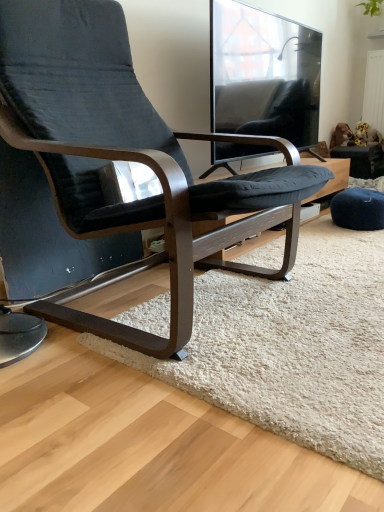
Question: Is white textured radiator at upper right to the right of white shaggy rug at center from the viewer's perspective?

Choices:
 (A) yes
 (B) no

Answer: (A)

Question: Considering the relative sizes of white textured radiator at upper right and white shaggy rug at center in the image provided, is white textured radiator at upper right bigger than white shaggy rug at center?

Choices:
 (A) yes
 (B) no

Answer: (B)

Question: From the image's perspective, is white textured radiator at upper right located above white shaggy rug at center?

Choices:
 (A) yes
 (B) no

Answer: (A)

Question: Is white textured radiator at upper right to the left of white shaggy rug at center from the viewer's perspective?

Choices:
 (A) yes
 (B) no

Answer: (B)

Question: Is white textured radiator at upper right far from white shaggy rug at center?

Choices:
 (A) yes
 (B) no

Answer: (A)

Question: Can you see white textured radiator at upper right touching white shaggy rug at center?

Choices:
 (A) no
 (B) yes

Answer: (A)

Question: From a real-world perspective, is white textured radiator at upper right below matte black chair at center?

Choices:
 (A) no
 (B) yes

Answer: (A)

Question: Can you confirm if white textured radiator at upper right is taller than matte black chair at center?

Choices:
 (A) yes
 (B) no

Answer: (B)

Question: Is white textured radiator at upper right wider than matte black chair at center?

Choices:
 (A) no
 (B) yes

Answer: (A)

Question: Does white textured radiator at upper right have a lesser height compared to matte black chair at center?

Choices:
 (A) yes
 (B) no

Answer: (A)

Question: Is white textured radiator at upper right oriented away from matte black chair at center?

Choices:
 (A) no
 (B) yes

Answer: (A)

Question: Can you confirm if white textured radiator at upper right is bigger than matte black chair at center?

Choices:
 (A) no
 (B) yes

Answer: (A)

Question: From the image's perspective, is matte black chair at center located beneath white textured radiator at upper right?

Choices:
 (A) no
 (B) yes

Answer: (B)